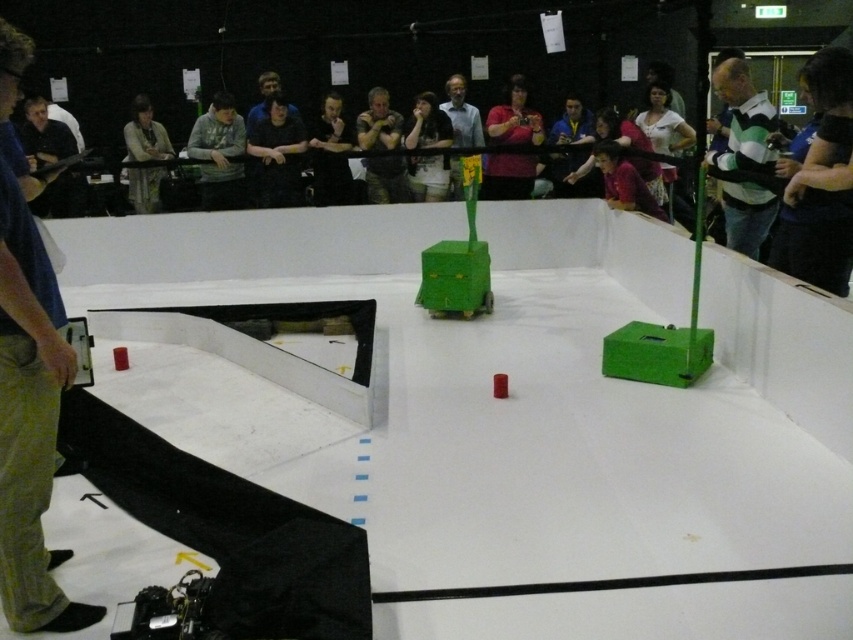
You are a participant in the robotics competition and need to navigate your robot from the starting zone at the left side of the arena to the flag on the robot at the center. Along the way, you must avoid the red cylindrical object. Which object, the blue jeans at left or the dark blue fabric at upper right, is closer to your starting position?

The blue jeans at left is closer to your starting position because it is located to the left of the dark blue fabric at upper right, which is further to the right.

You are a spectator at the robotics competition and want to take a photo of both the green striped shirt at upper right and the matte black shirt at upper left. Which shirt should you position your camera closer to in order to capture both in the same frame?

To capture both the green striped shirt at upper right and the matte black shirt at upper left in the same frame, position your camera closer to the matte black shirt at upper left since the green striped shirt at upper right might be wider and thus require a wider angle or closer proximity to include both in the frame.